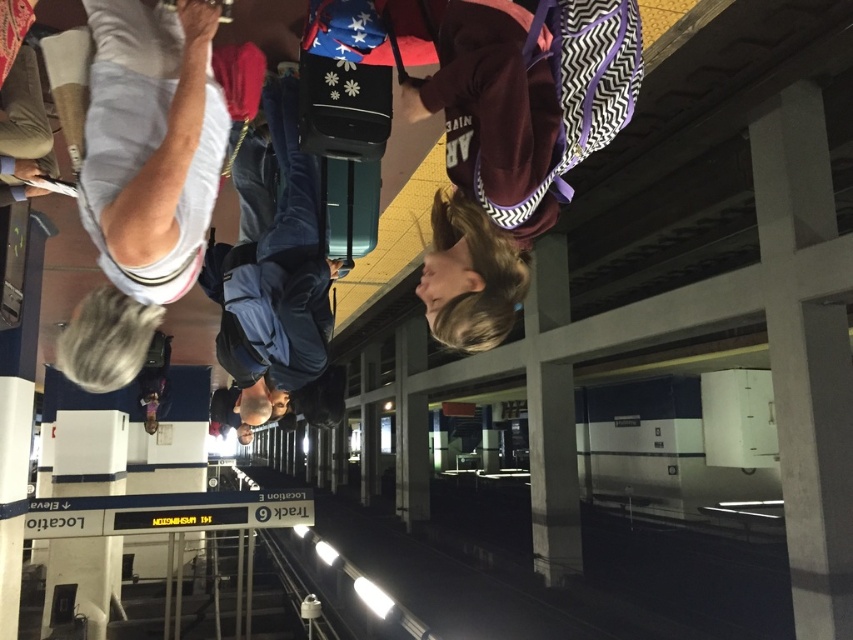
You are standing on an upside down train station platform. You see a white fabric shirt at upper left and a dark blue fabric backpack at center. Which one is more to the right?

The white fabric shirt at upper left is positioned on the right side of dark blue fabric backpack at center, so the white fabric shirt at upper left is more to the right.

You are a photographer trying to capture a unique shot of the white fabric shirt at upper left and the dark blue fabric backpack at center from this upside down perspective. Which object should you focus on first to ensure both are in frame?

The white fabric shirt at upper left is located above the dark blue fabric backpack at center, so you should focus on the white fabric shirt at upper left first to ensure both are in frame.

You are standing on the train station platform and want to locate the white fabric shirt at upper left. According to the coordinates provided, where exactly is it positioned?

The white fabric shirt at upper left is positioned at coordinates point (143, 177).